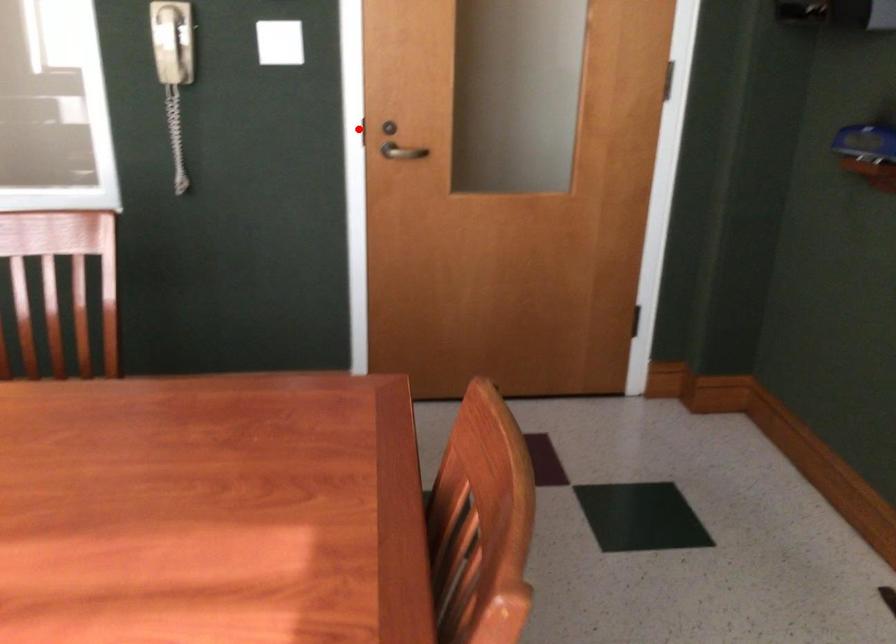
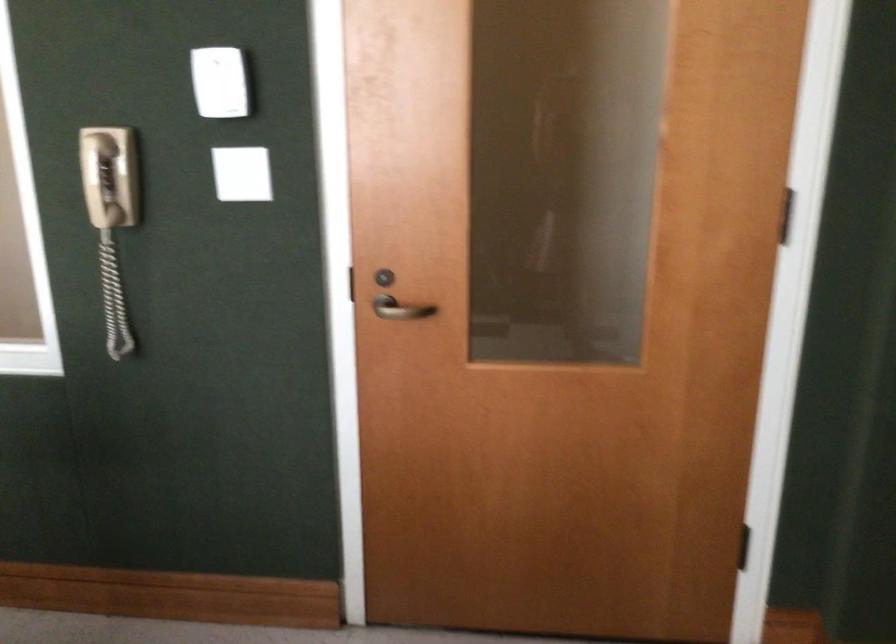
Question: A red point is marked in image1. In image2, is the corresponding 3D point closer to the camera or farther? Reply with the corresponding letter.

Choices:
 (A) The corresponding 3D point is closer.
 (B) The corresponding 3D point is farther.

Answer: (A)